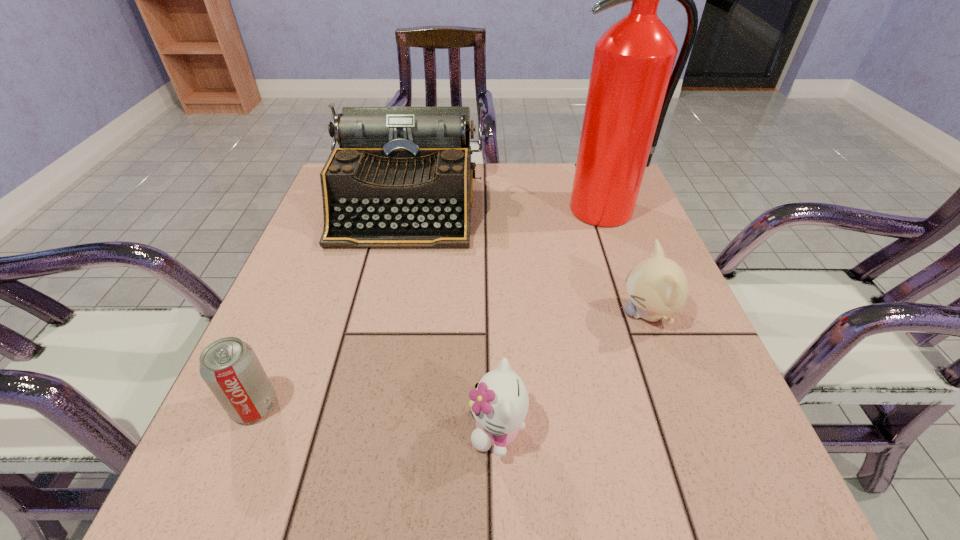
Find the location of `fire extinguisher that is at the right edge`. fire extinguisher that is at the right edge is located at coordinates (631, 85).

At what (x,y) coordinates should I click in order to perform the action: click on kitten at the right edge. Please return your answer as a coordinate pair (x, y). Looking at the image, I should click on (657, 286).

The width and height of the screenshot is (960, 540). I want to click on object that is at the far left corner, so click(402, 178).

Image resolution: width=960 pixels, height=540 pixels. In order to click on object that is at the far right corner in this screenshot , I will do `click(631, 85)`.

You are a GUI agent. You are given a task and a screenshot of the screen. Output one action in this format:
    pyautogui.click(x=<x>, y=<y>)
    Task: Click on the vacant space at the far edge of the desktop
    
    Given the screenshot: What is the action you would take?
    pyautogui.click(x=497, y=180)

At what (x,y) coordinates should I click in order to perform the action: click on free location at the near edge of the desktop. Please return your answer as a coordinate pair (x, y). The image size is (960, 540). Looking at the image, I should click on (322, 509).

In the image, there is a desktop. Where is `vacant region at the left edge`? The width and height of the screenshot is (960, 540). vacant region at the left edge is located at coordinates (317, 266).

The width and height of the screenshot is (960, 540). Identify the location of free space at the right edge of the desktop. (612, 237).

This screenshot has width=960, height=540. Identify the location of vacant region at the near left corner of the desktop. (189, 484).

In the image, there is a desktop. At what (x,y) coordinates should I click in order to perform the action: click on free region at the near right corner. Please return your answer as a coordinate pair (x, y). Looking at the image, I should click on (736, 474).